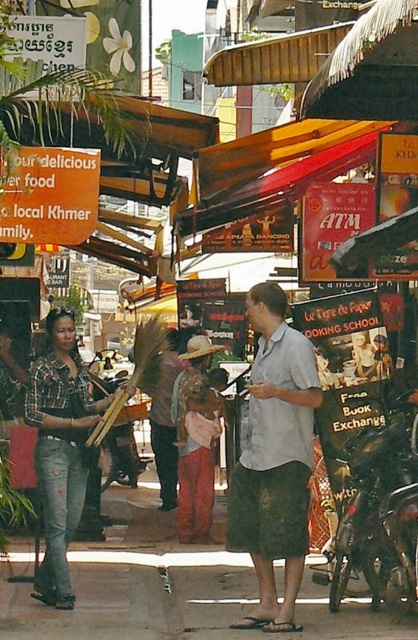
Who is more distant from viewer, (x=265, y=589) or (x=357, y=451)?

The point (x=357, y=451) is more distant.

Who is more forward, (x=254, y=518) or (x=382, y=554)?

Point (x=382, y=554)

At what (x,y) coordinates should I click in order to perform the action: click on light gray cotton shirt at center. Please return your answer as a coordinate pair (x, y). Image resolution: width=418 pixels, height=640 pixels. Looking at the image, I should click on (275, 460).

Does denim jeans at center appear over shiny black motorcycle at center?

Yes, denim jeans at center is above shiny black motorcycle at center.

The image size is (418, 640). What do you see at coordinates (60, 449) in the screenshot? I see `denim jeans at center` at bounding box center [60, 449].

Locate an element on the screen. The image size is (418, 640). denim jeans at center is located at coordinates (60, 449).

Can you confirm if light gray cotton shirt at center is positioned to the right of denim jeans at center?

Indeed, light gray cotton shirt at center is positioned on the right side of denim jeans at center.

Based on the photo, is the position of light gray cotton shirt at center more distant than that of denim jeans at center?

No, light gray cotton shirt at center is in front of denim jeans at center.

Which is behind, point (272, 604) or point (74, 509)?

The point (74, 509) is more distant.

Locate an element on the screen. This screenshot has width=418, height=640. light gray cotton shirt at center is located at coordinates (275, 460).